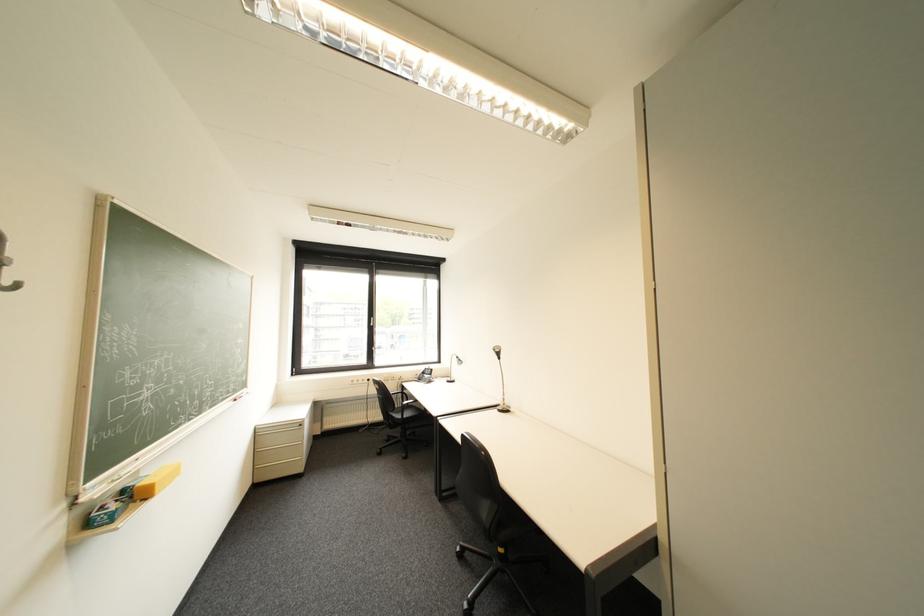
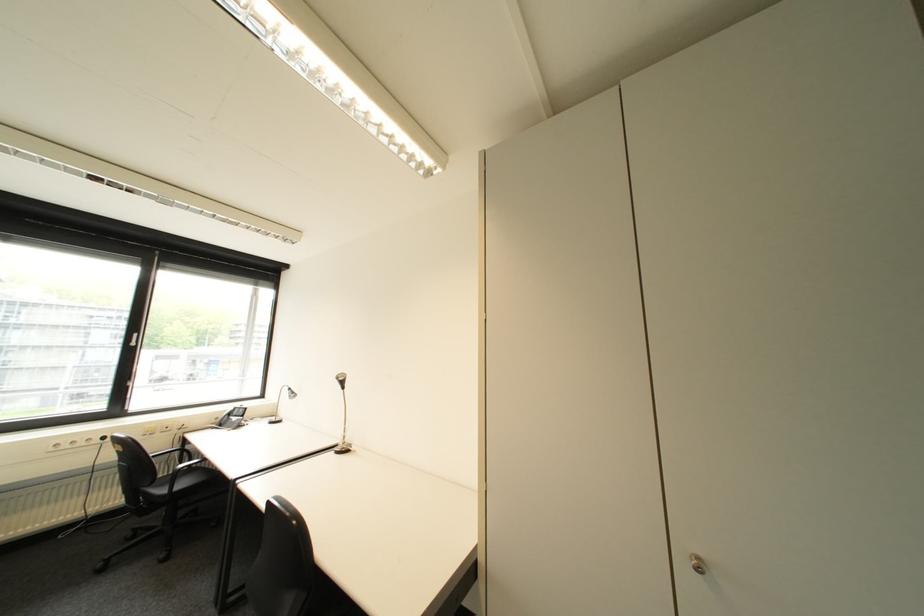
Find the pixel in the second image that matches (379,381) in the first image.

(114, 439)